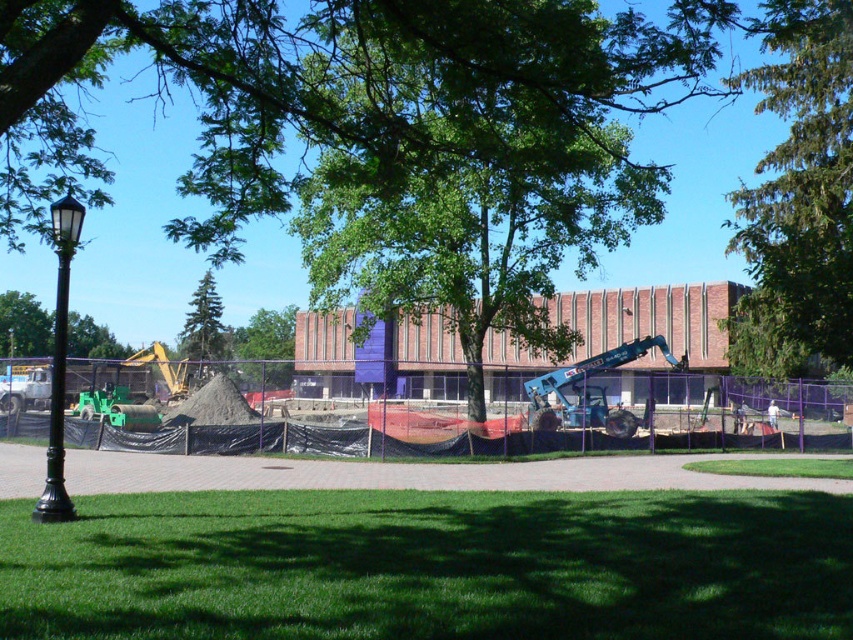
Question: Which of the following is the farthest from the observer?

Choices:
 (A) (749, 234)
 (B) (241, 348)
 (C) (813, 460)
 (D) (201, 378)

Answer: (B)

Question: Which point is farther from the camera taking this photo?

Choices:
 (A) (216, 337)
 (B) (283, 378)

Answer: (A)

Question: Considering the relative positions of green leafy tree at upper center and green grass at lower center in the image provided, where is green leafy tree at upper center located with respect to green grass at lower center?

Choices:
 (A) left
 (B) right

Answer: (B)

Question: Where is black polished metal lamp post at left located in relation to green leafy tree at center in the image?

Choices:
 (A) right
 (B) left

Answer: (A)

Question: Is green grass at lower left smaller than blue metallic excavator at center?

Choices:
 (A) no
 (B) yes

Answer: (B)

Question: Which object is closer to the camera taking this photo?

Choices:
 (A) green leafy tree at center
 (B) blue metallic excavator at center
 (C) green grass at lower center

Answer: (C)